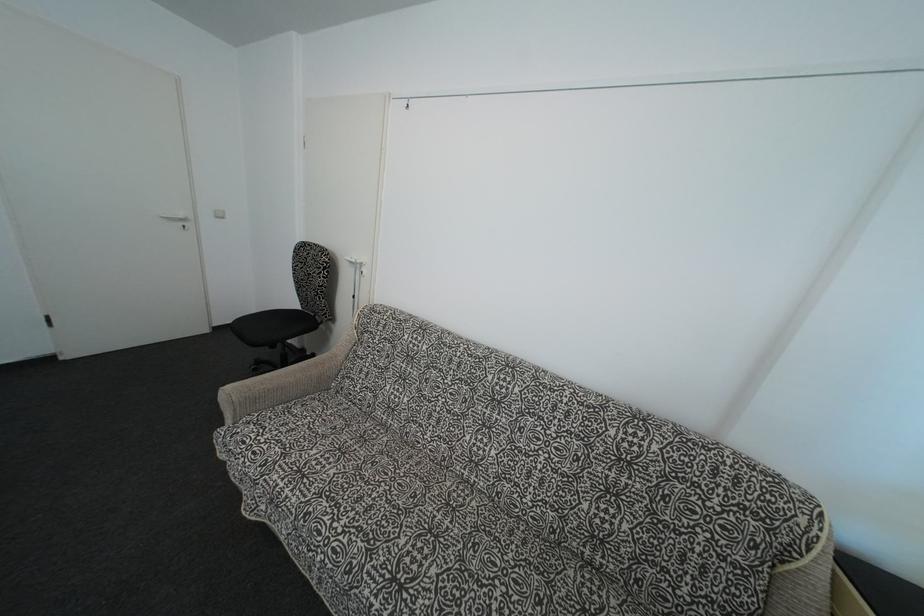
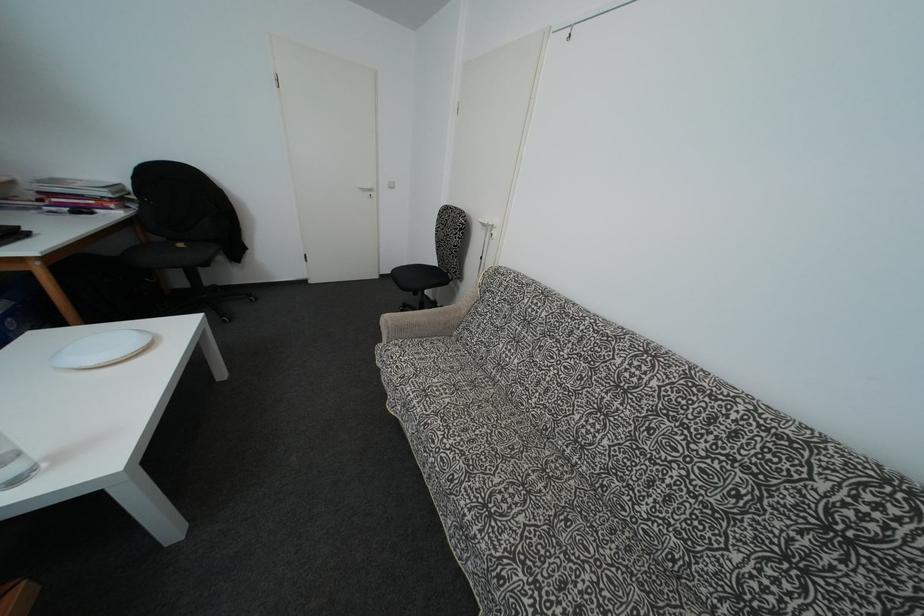
Question: The camera is either moving clockwise (left) or counter-clockwise (right) around the object. The first image is from the beginning of the video and the second image is from the end. Is the camera moving left or right when shooting the video?

Choices:
 (A) Left
 (B) Right

Answer: (B)